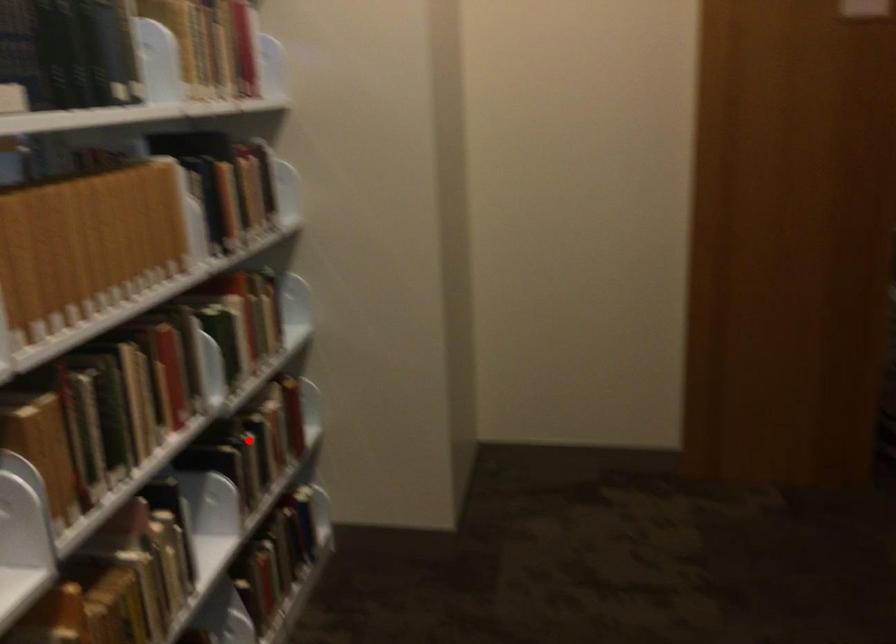
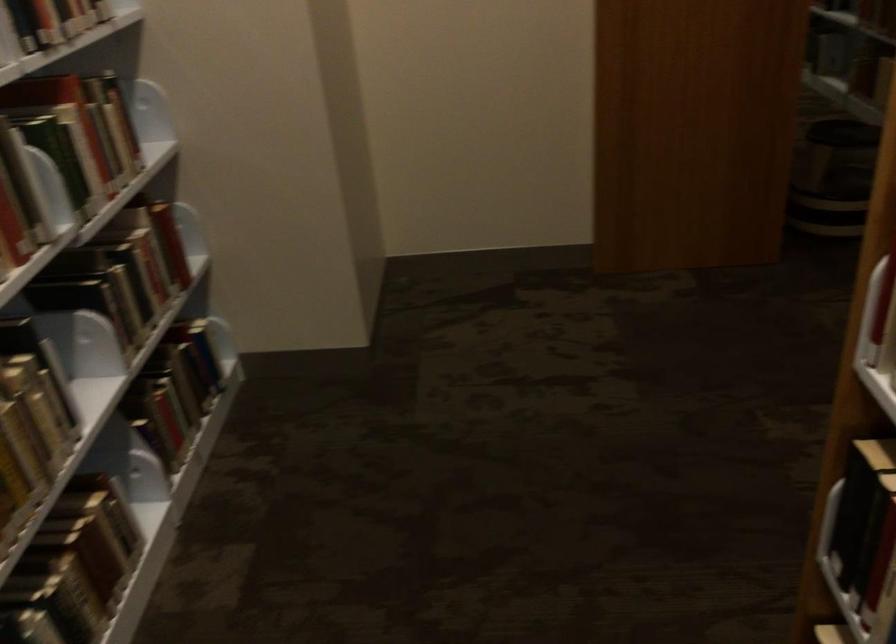
The point at the highlighted location is marked in the first image. Where is the corresponding point in the second image?

(119, 272)